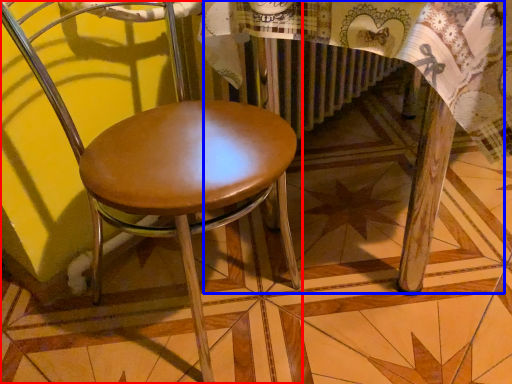
Question: Which of the following is the closest to the observer, chair (highlighted by a red box) or round table (highlighted by a blue box)?

Choices:
 (A) chair
 (B) round table

Answer: (A)